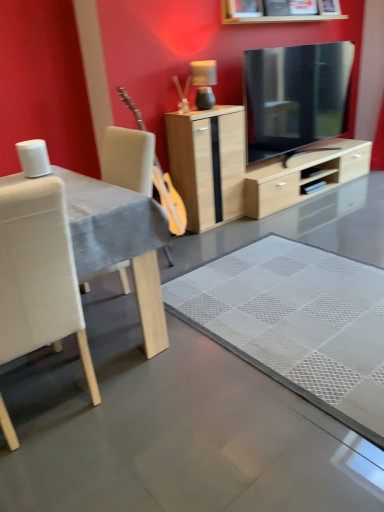
The image size is (384, 512). Describe the element at coordinates (39, 274) in the screenshot. I see `white fabric chair at left` at that location.

Where is `white fabric table at left`? white fabric table at left is located at coordinates (119, 242).

What do you see at coordinates (119, 242) in the screenshot?
I see `white fabric table at left` at bounding box center [119, 242].

This screenshot has width=384, height=512. Describe the element at coordinates (204, 82) in the screenshot. I see `matte gray lamp at center` at that location.

Image resolution: width=384 pixels, height=512 pixels. Find the location of `white fabric chair at left`. white fabric chair at left is located at coordinates (39, 274).

Which of these two, light wood/glossy cabinet at center or white fabric chair at left, is smaller?

Smaller between the two is light wood/glossy cabinet at center.

Would you say light wood/glossy cabinet at center is outside white fabric chair at left?

Indeed, light wood/glossy cabinet at center is completely outside white fabric chair at left.

Is light wood/glossy cabinet at center oriented away from white fabric chair at left?

A: light wood/glossy cabinet at center does not have its back to white fabric chair at left.

Looking at this image, how far apart are white fabric table at left and light wood/glossy cabinet at center?

A distance of 4.41 feet exists between white fabric table at left and light wood/glossy cabinet at center.

Considering the positions of point (131, 228) and point (204, 170), is point (131, 228) closer or farther from the camera than point (204, 170)?

Point (131, 228).

Is white fabric table at left wider than light wood/glossy cabinet at center?

Correct, the width of white fabric table at left exceeds that of light wood/glossy cabinet at center.

Which is more to the left, white fabric table at left or light wood/glossy cabinet at center?

Positioned to the left is white fabric table at left.

Can you see white fabric chair at left touching white fabric table at left?

No, white fabric chair at left is not with white fabric table at left.

Would you say white fabric table at left is part of white fabric chair at left's contents?

No, white fabric table at left is not inside white fabric chair at left.

Can you confirm if white fabric chair at left is positioned to the right of white fabric table at left?

No.

From a real-world perspective, who is located lower, white fabric chair at left or white fabric table at left?

white fabric chair at left.

Considering the relative sizes of matte gray lamp at center and white fabric table at left in the image provided, is matte gray lamp at center thinner than white fabric table at left?

Yes, matte gray lamp at center is thinner than white fabric table at left.

From a real-world perspective, is matte gray lamp at center located higher than white fabric table at left?

Yes.

From the image's perspective, which is below, matte gray lamp at center or white fabric table at left?

From the image's view, white fabric table at left is below.

Who is taller, matte gray lamp at center or white fabric table at left?

With more height is white fabric table at left.

From the image's perspective, who appears lower, white fabric table at left or white fabric chair at left?

white fabric chair at left, from the image's perspective.

Based on the photo, is white fabric table at left turned away from white fabric chair at left?

No, white fabric chair at left is not at the back of white fabric table at left.

Would you say white fabric table at left contains white fabric chair at left?

No.

From the picture: How many degrees apart are the facing directions of white fabric table at left and white fabric chair at left?

They differ by 90 degrees in their facing directions.

From a real-world perspective, is white fabric chair at left positioned above or below matte gray lamp at center?

white fabric chair at left is below matte gray lamp at center.

What's the angular difference between white fabric chair at left and matte gray lamp at center's facing directions?

They differ by 180 degrees in their facing directions.

Consider the image. Is matte gray lamp at center surrounded by white fabric chair at left?

No, matte gray lamp at center is located outside of white fabric chair at left.

Is white fabric chair at left facing away from matte gray lamp at center?

No.

Considering the sizes of objects matte gray lamp at center and light wood/glossy cabinet at center in the image provided, who is thinner, matte gray lamp at center or light wood/glossy cabinet at center?

With smaller width is matte gray lamp at center.

Are matte gray lamp at center and light wood/glossy cabinet at center making contact?

matte gray lamp at center and light wood/glossy cabinet at center are clearly separated.

At what (x,y) coordinates should I click in order to perform the action: click on lamp to the left of light wood/glossy cabinet at center. Please return your answer as a coordinate pair (x, y). Looking at the image, I should click on (204, 82).

From the image's perspective, is matte gray lamp at center above light wood/glossy cabinet at center?

Yes, from the image's perspective, matte gray lamp at center is over light wood/glossy cabinet at center.

At what (x,y) coordinates should I click in order to perform the action: click on cabinetry behind the white fabric chair at left. Please return your answer as a coordinate pair (x, y). Looking at the image, I should click on (208, 163).

Locate an element on the screen. The height and width of the screenshot is (512, 384). cabinetry located above the white fabric table at left (from the image's perspective) is located at coordinates (208, 163).

Looking at the image, which one is located closer to matte gray lamp at center, white fabric chair at left or light wood/glossy cabinet at center?

Among the two, light wood/glossy cabinet at center is located nearer to matte gray lamp at center.

From the image, which object appears to be nearer to white fabric table at left, white fabric chair at left or matte gray lamp at center?

The object closer to white fabric table at left is white fabric chair at left.

From the picture: Which object lies further to the anchor point white fabric chair at left, light wood/glossy cabinet at center or white fabric table at left?

Among the two, light wood/glossy cabinet at center is located further to white fabric chair at left.

Based on their spatial positions, is white fabric chair at left or light wood/glossy cabinet at center closer to white fabric table at left?

The object closer to white fabric table at left is white fabric chair at left.

From the image, which object appears to be farther from white fabric table at left, matte gray lamp at center or white fabric chair at left?

matte gray lamp at center.

Estimate the real-world distances between objects in this image. Which object is further from matte gray lamp at center, light wood/glossy cabinet at center or white fabric table at left?

Among the two, white fabric table at left is located further to matte gray lamp at center.

Estimate the real-world distances between objects in this image. Which object is closer to light wood/glossy cabinet at center, white fabric chair at left or matte gray lamp at center?

Based on the image, matte gray lamp at center appears to be nearer to light wood/glossy cabinet at center.

Which object lies further to the anchor point light wood/glossy cabinet at center, white fabric table at left or white fabric chair at left?

white fabric chair at left is further to light wood/glossy cabinet at center.

Where is `cabinetry between white fabric table at left and matte gray lamp at center in the front-back direction`? The image size is (384, 512). cabinetry between white fabric table at left and matte gray lamp at center in the front-back direction is located at coordinates (208, 163).

You are a GUI agent. You are given a task and a screenshot of the screen. Output one action in this format:
    pyautogui.click(x=<x>, y=<y>)
    Task: Click on the desk between white fabric chair at left and matte gray lamp at center in the front-back direction
    
    Given the screenshot: What is the action you would take?
    pyautogui.click(x=119, y=242)

The image size is (384, 512). I want to click on cabinetry between white fabric chair at left and matte gray lamp at center from front to back, so click(x=208, y=163).

Where is `desk between white fabric chair at left and light wood/glossy cabinet at center from front to back`? Image resolution: width=384 pixels, height=512 pixels. desk between white fabric chair at left and light wood/glossy cabinet at center from front to back is located at coordinates (119, 242).